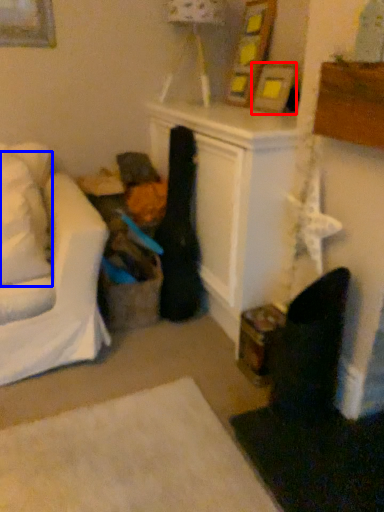
Question: Which point is closer to the camera, picture frame (highlighted by a red box) or pillow (highlighted by a blue box)?

Choices:
 (A) picture frame
 (B) pillow

Answer: (B)